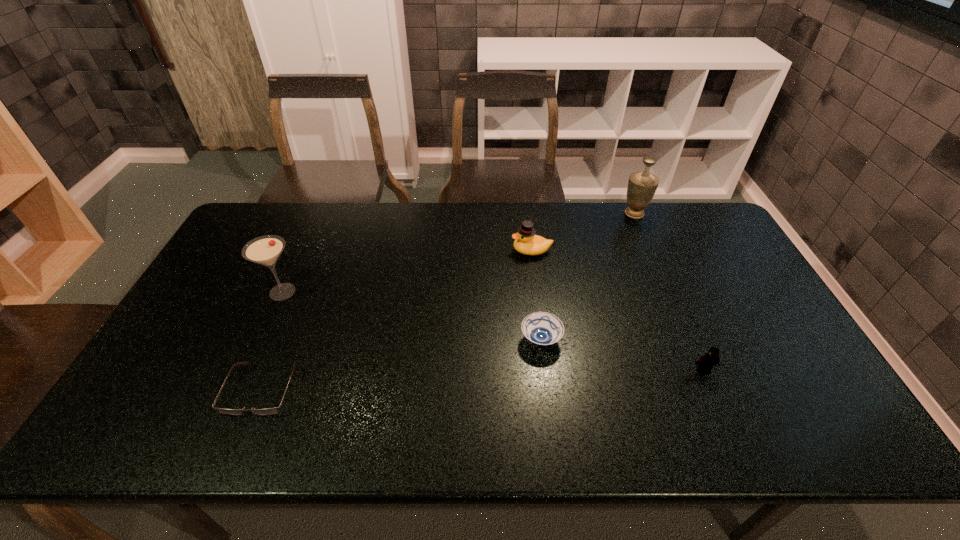
This screenshot has width=960, height=540. What are the coordinates of `vacant area situated 0.260m on the front of the urn` in the screenshot? It's located at (660, 273).

At what (x,y) coordinates should I click in order to perform the action: click on vacant point located 0.330m on the back of the fourth nearest object. Please return your answer as a coordinate pair (x, y). This screenshot has height=540, width=960. Looking at the image, I should click on (317, 215).

The image size is (960, 540). Find the location of `free region located 0.210m on the front-facing side of the duck`. free region located 0.210m on the front-facing side of the duck is located at coordinates (447, 251).

Find the location of `vacant point located on the front-facing side of the duck`. vacant point located on the front-facing side of the duck is located at coordinates (438, 251).

The height and width of the screenshot is (540, 960). What are the coordinates of `blank space located on the front-facing side of the duck` in the screenshot? It's located at (401, 251).

Identify the location of free spot located 0.100m on the face of the fourth tallest object. This screenshot has width=960, height=540. (720, 410).

At what (x,y) coordinates should I click in order to perform the action: click on free space located 0.060m on the right of the second shortest object. Please return your answer as a coordinate pair (x, y). This screenshot has width=960, height=540. Looking at the image, I should click on (585, 340).

In order to click on vacant region located 0.050m on the front-facing side of the shortest object in this screenshot , I will do `click(242, 439)`.

The height and width of the screenshot is (540, 960). Identify the location of urn that is at the far edge. (642, 185).

Identify the location of duck that is at the far edge. The width and height of the screenshot is (960, 540). (527, 243).